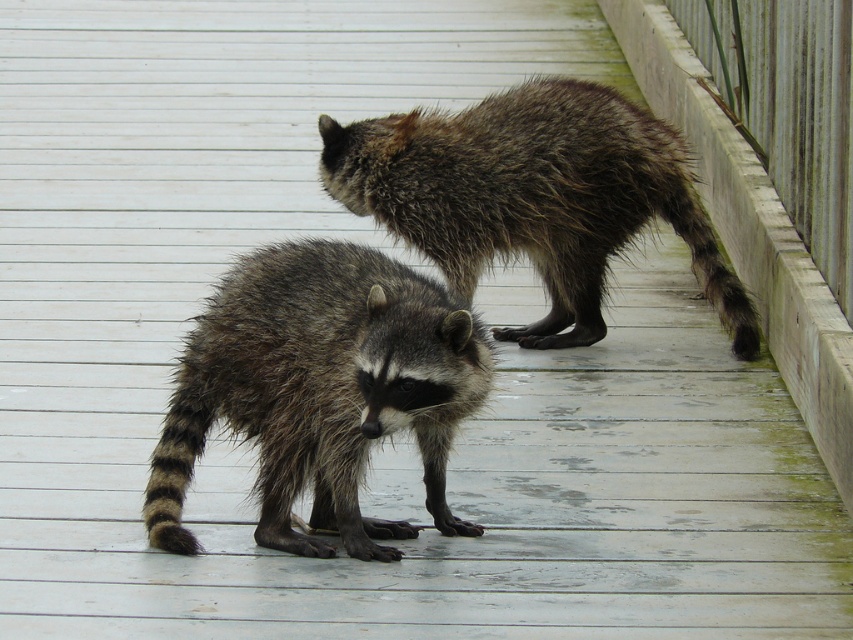
Who is positioned more to the left, rough fur raccoon at center or fuzzy brown raccoon at upper center?

From the viewer's perspective, rough fur raccoon at center appears more on the left side.

Can you confirm if rough fur raccoon at center is wider than fuzzy brown raccoon at upper center?

Result: No, rough fur raccoon at center is not wider than fuzzy brown raccoon at upper center.

Identify the location of rough fur raccoon at center. Image resolution: width=853 pixels, height=640 pixels. (320, 390).